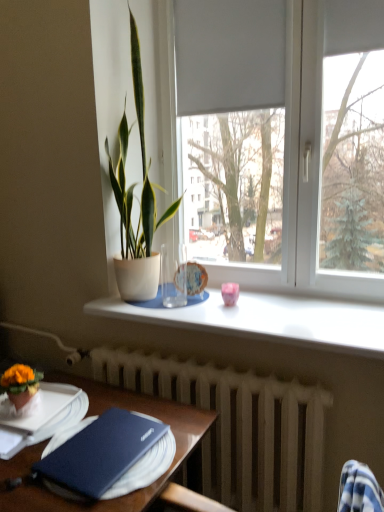
The width and height of the screenshot is (384, 512). Identify the location of vacant space to the right of orange felt flower pot at lower left, placed as the second houseplant when sorted from right to left. (58, 407).